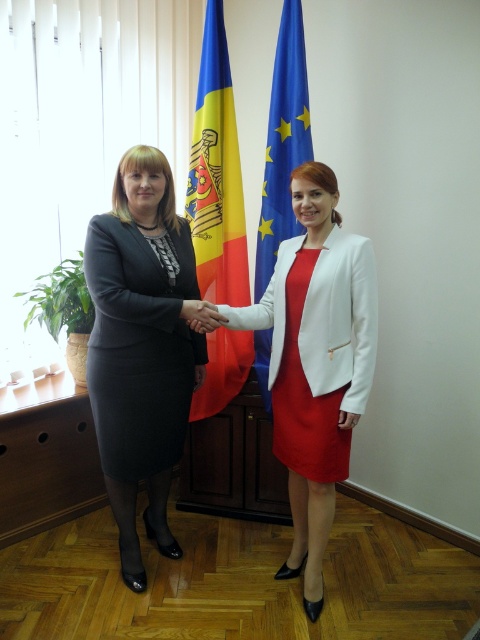
You are a photographer adjusting the lighting in the scene. You notice the white matte hand at center and the black matte hand at center. Which hand should you focus on to ensure proper exposure for the darker tones?

The black matte hand at center should be focused on for proper exposure since it absorbs more light and requires careful adjustment to capture details without underexposure.

Based on the photo, you are a photographer adjusting your camera settings to capture the scene. You need to focus on the white matte blazer at center. Based on its position, which woman is wearing the white matte blazer?

The woman on the right is wearing the white matte blazer at center because the blazer is positioned at point (340, 320), which corresponds to the location of the woman on the right.